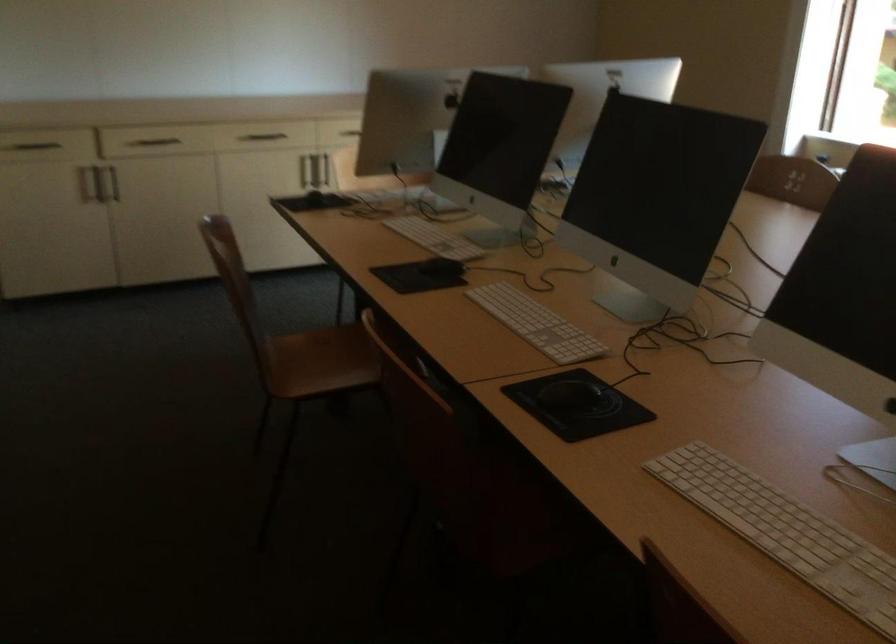
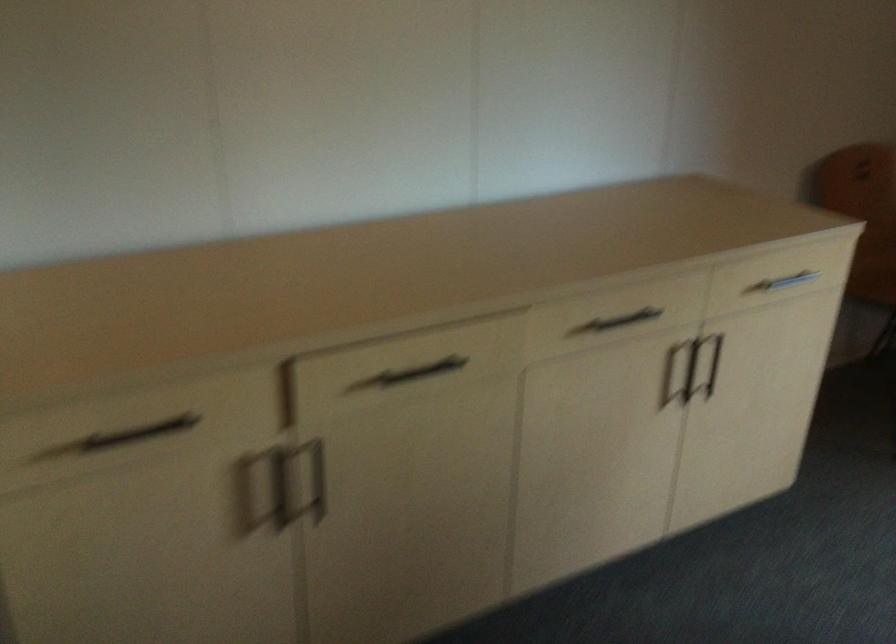
The images are taken continuously from a first-person perspective. In which direction are you moving?

The movement direction of the cameraman is left, forward.